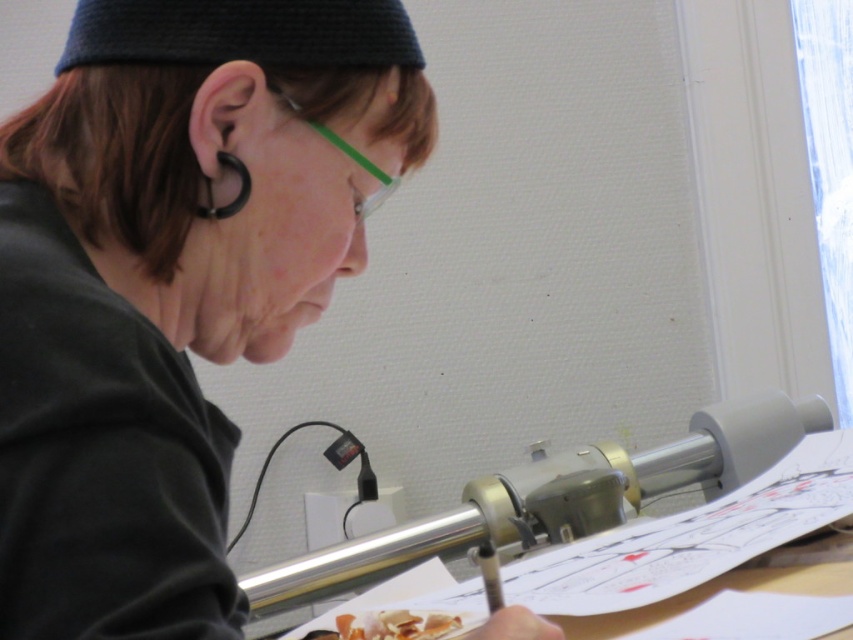
Can you confirm if slightly translucent paper at lower center is wider than clear plastic glasses at upper center?

Correct, the width of slightly translucent paper at lower center exceeds that of clear plastic glasses at upper center.

Between slightly translucent paper at lower center and clear plastic glasses at upper center, which one has more height?

clear plastic glasses at upper center is taller.

The height and width of the screenshot is (640, 853). What do you see at coordinates (396, 625) in the screenshot? I see `slightly translucent paper at lower center` at bounding box center [396, 625].

Locate an element on the screen. This screenshot has width=853, height=640. slightly translucent paper at lower center is located at coordinates (396, 625).

Which is more to the left, black matte paper at center or clear plastic glasses at upper center?

Positioned to the left is black matte paper at center.

Does black matte paper at center have a lesser height compared to clear plastic glasses at upper center?

In fact, black matte paper at center may be taller than clear plastic glasses at upper center.

What do you see at coordinates (223, 154) in the screenshot? The image size is (853, 640). I see `black matte paper at center` at bounding box center [223, 154].

What are the coordinates of `black matte paper at center` in the screenshot? It's located at (223, 154).

How far apart are black matte paper at center and slightly translucent paper at lower center?

black matte paper at center and slightly translucent paper at lower center are 12.89 inches apart from each other.

Is point (15, 259) more distant than point (419, 627)?

That is False.

Identify the location of black matte paper at center. (223, 154).